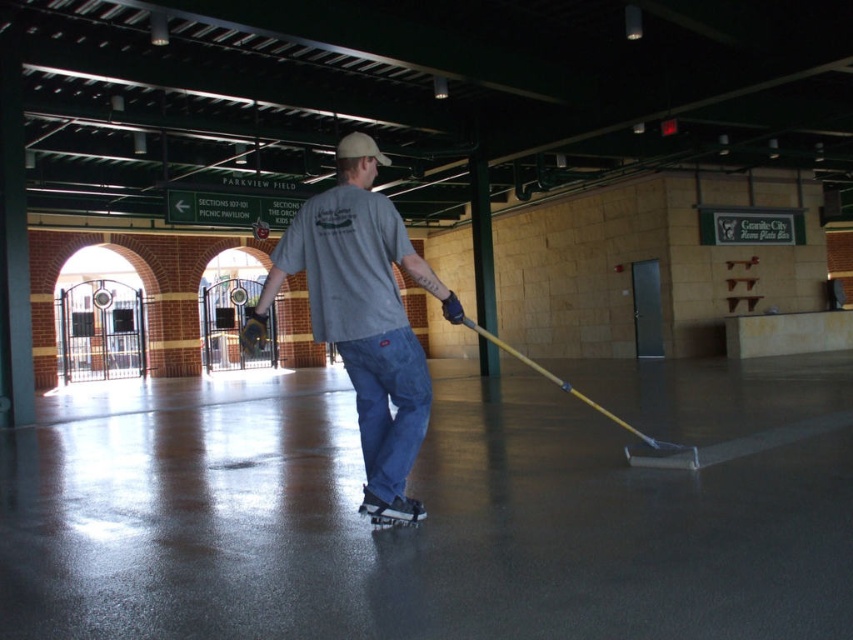
Does point (413, 448) come farther from viewer compared to point (409, 512)?

No, (413, 448) is closer to viewer.

Locate an element on the screen. The image size is (853, 640). denim pants at center is located at coordinates (363, 307).

What are the coordinates of `denim pants at center` in the screenshot? It's located at (363, 307).